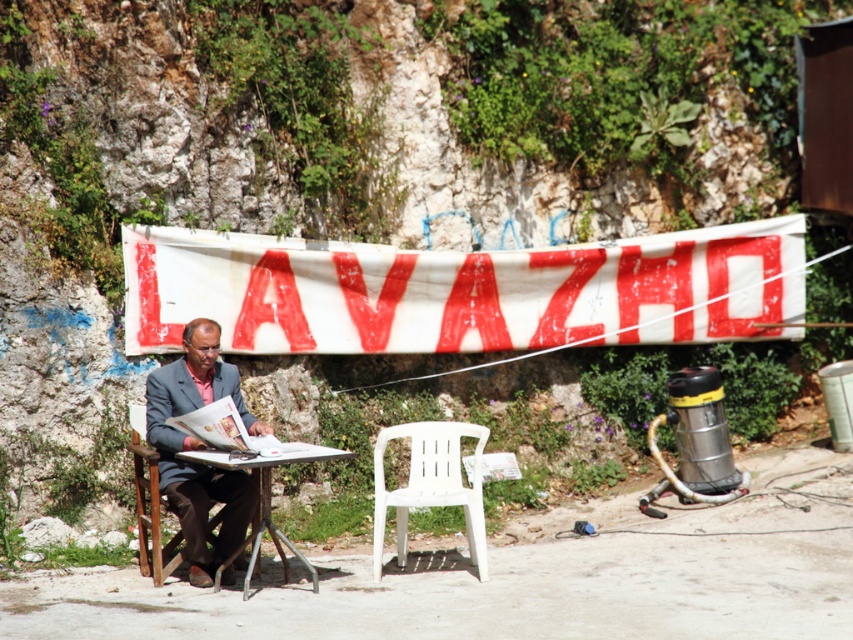
You are a painter standing 1.5 meters away from the metallic silver table at center. You want to paint the white fabric banner at center. Can you reach it without moving from your current position?

The white fabric banner at center and metallic silver table at center are 2.37 meters apart. Since you are 1.5 meters away from the metallic silver table at center, you are 1.5 meters away from the metallic silver table at center plus 2.37 meters to the white fabric banner at center, totaling 3.87 meters away from the white fabric banner at center. Therefore, you cannot reach it without moving.

You are a photographer trying to capture a portrait of the matte brown suit at center and the wooden chair at left. Which object should you focus on first if you want to ensure both are in sharp focus?

The matte brown suit at center is much taller than the wooden chair at left, so focusing on the matte brown suit at center first will help ensure both are in sharp focus since it is the larger subject.